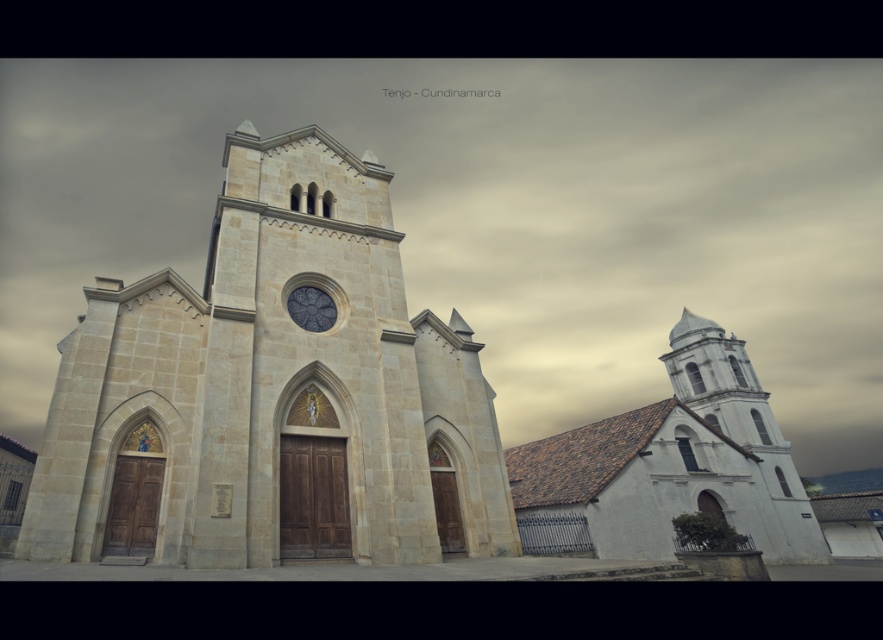
Looking at this image, you are standing in front of the historic church complex and want to take a photo that includes both the main church entrance and the smaller white structure to its right. Which of the two points, point (379, 188) or point (314, 312), is closer to your camera position?

Point (379, 188) is further to the camera than point (314, 312), so point (314, 312) is closer to your camera position.

You are a tourist standing in front of the historic church complex. You notice the light beige stone church tower at center and the stained glass window at center. Which of these two objects is wider?

The light beige stone church tower at center is wider than the stained glass window at center according to the description.